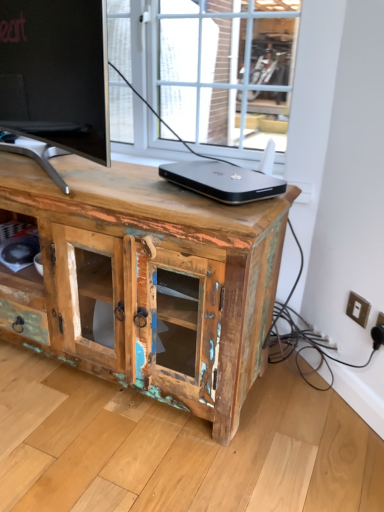
Question: Considering the relative sizes of weathered wood cabinet at center and white plastic electric outlet at lower right, positioned as the first electric outlet in right-to-left order, in the image provided, is weathered wood cabinet at center thinner than white plastic electric outlet at lower right, positioned as the first electric outlet in right-to-left order,?

Choices:
 (A) no
 (B) yes

Answer: (A)

Question: Considering the relative positions of weathered wood cabinet at center and white plastic electric outlet at lower right, which ranks as the 1th electric outlet in front-to-back order, in the image provided, is weathered wood cabinet at center to the left of white plastic electric outlet at lower right, which ranks as the 1th electric outlet in front-to-back order, from the viewer's perspective?

Choices:
 (A) yes
 (B) no

Answer: (A)

Question: Can you confirm if weathered wood cabinet at center is shorter than white plastic electric outlet at lower right, which is counted as the second electric outlet, starting from the back?

Choices:
 (A) yes
 (B) no

Answer: (B)

Question: Can you confirm if weathered wood cabinet at center is positioned to the right of white plastic electric outlet at lower right, positioned as the first electric outlet in right-to-left order?

Choices:
 (A) yes
 (B) no

Answer: (B)

Question: Is weathered wood cabinet at center oriented away from white plastic electric outlet at lower right, positioned as the 2th electric outlet in left-to-right order?

Choices:
 (A) no
 (B) yes

Answer: (A)

Question: Considering the relative positions of sleek silver laptop at center and white plastic electric outlet at lower right, which is counted as the second electric outlet, starting from the back, in the image provided, is sleek silver laptop at center to the left or to the right of white plastic electric outlet at lower right, which is counted as the second electric outlet, starting from the back,?

Choices:
 (A) left
 (B) right

Answer: (A)

Question: From their relative heights in the image, would you say sleek silver laptop at center is taller or shorter than white plastic electric outlet at lower right, positioned as the first electric outlet in right-to-left order?

Choices:
 (A) tall
 (B) short

Answer: (B)

Question: Considering their positions, is sleek silver laptop at center located in front of or behind white plastic electric outlet at lower right, which is counted as the second electric outlet, starting from the back?

Choices:
 (A) front
 (B) behind

Answer: (A)

Question: Based on their sizes in the image, would you say sleek silver laptop at center is bigger or smaller than white plastic electric outlet at lower right, which ranks as the 1th electric outlet in front-to-back order?

Choices:
 (A) big
 (B) small

Answer: (A)

Question: Is point (236, 429) closer or farther from the camera than point (226, 163)?

Choices:
 (A) closer
 (B) farther

Answer: (A)

Question: Based on their sizes in the image, would you say weathered wood cabinet at center is bigger or smaller than sleek silver laptop at center?

Choices:
 (A) small
 (B) big

Answer: (B)

Question: From the image's perspective, is weathered wood cabinet at center positioned above or below sleek silver laptop at center?

Choices:
 (A) above
 (B) below

Answer: (B)

Question: Is weathered wood cabinet at center inside the boundaries of sleek silver laptop at center, or outside?

Choices:
 (A) outside
 (B) inside

Answer: (A)

Question: Is white plastic electric outlet at lower right, which is counted as the second electric outlet, starting from the back, wider or thinner than white plastic switch at lower right, placed as the 2th electric outlet when sorted from front to back?

Choices:
 (A) thin
 (B) wide

Answer: (B)

Question: Considering the positions of point (379, 324) and point (345, 312), is point (379, 324) closer or farther from the camera than point (345, 312)?

Choices:
 (A) closer
 (B) farther

Answer: (A)